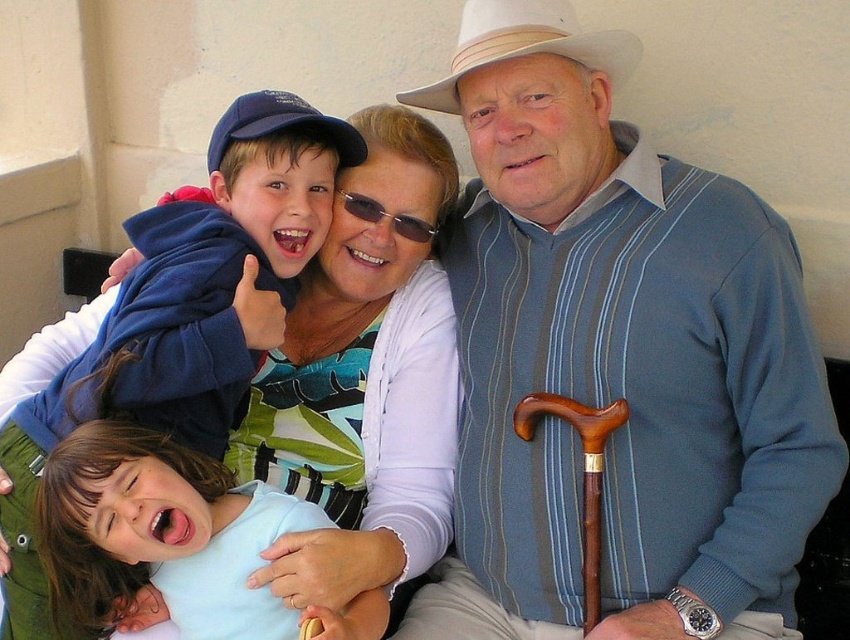
Is blue fleece jacket at upper left positioned at the back of light blue shirt at lower left?

Yes.

Who is positioned more to the right, blue fleece jacket at upper left or light blue shirt at lower left?

Positioned to the right is light blue shirt at lower left.

Is point (261, 212) positioned behind point (252, 592)?

Yes, point (261, 212) is farther from viewer.

Locate an element on the screen. The image size is (850, 640). blue fleece jacket at upper left is located at coordinates (187, 310).

Does white felt cowboy hat at upper center appear on the right side of wooden cane at lower right?

In fact, white felt cowboy hat at upper center is to the left of wooden cane at lower right.

Who is higher up, white felt cowboy hat at upper center or wooden cane at lower right?

Positioned higher is white felt cowboy hat at upper center.

Is point (533, 38) closer to camera compared to point (524, 420)?

Yes, point (533, 38) is closer to viewer.

This screenshot has width=850, height=640. I want to click on white felt cowboy hat at upper center, so [x=524, y=45].

Who is more distant from viewer, (576, 145) or (582, 54)?

Positioned behind is point (576, 145).

Does point (482, 166) lie behind point (598, 68)?

That is True.

This screenshot has height=640, width=850. What are the coordinates of `blue striped sweater at center` in the screenshot? It's located at (616, 358).